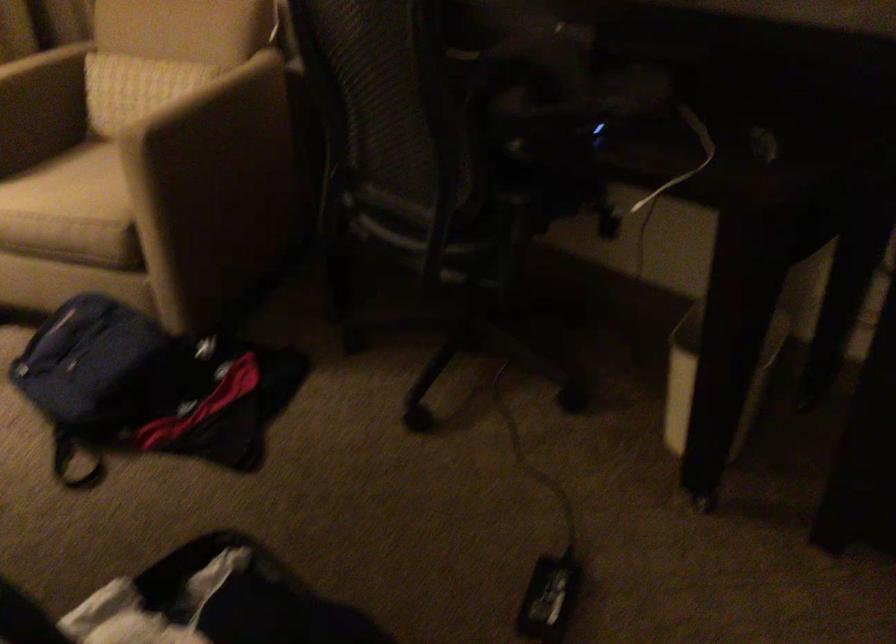
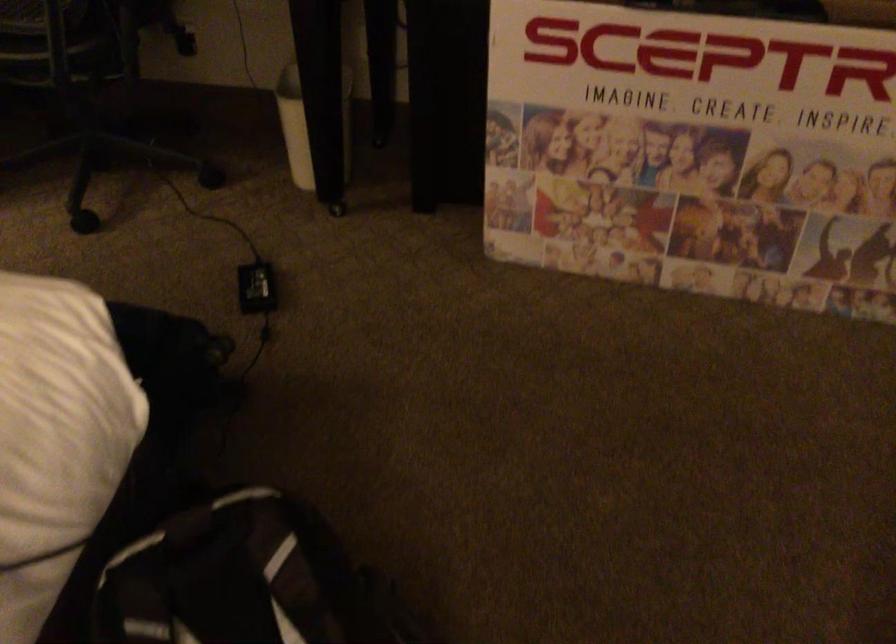
Question: How did the camera likely rotate?

Choices:
 (A) Left
 (B) Right
 (C) Up
 (D) Down

Answer: (B)